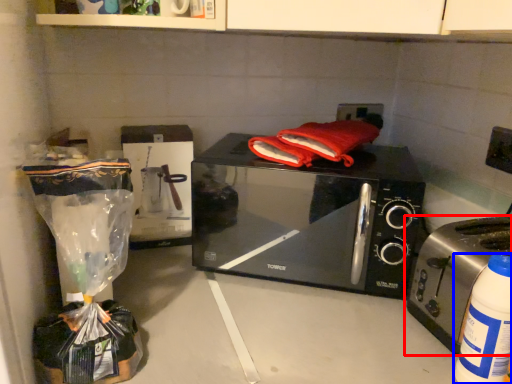
Question: Which object is further to the camera taking this photo, toaster (highlighted by a red box) or bottle (highlighted by a blue box)?

Choices:
 (A) toaster
 (B) bottle

Answer: (A)